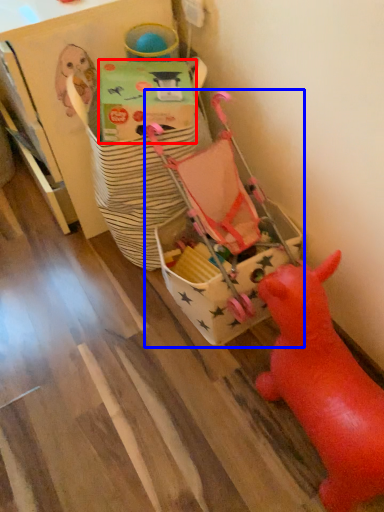
Question: Which point is further to the camera, cardboard box (highlighted by a red box) or toy (highlighted by a blue box)?

Choices:
 (A) cardboard box
 (B) toy

Answer: (B)